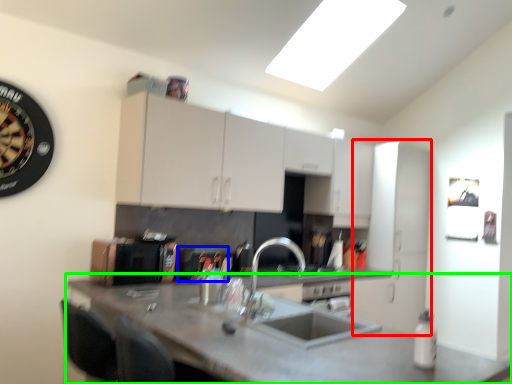
Question: Which object is the closest to the cabinetry (highlighted by a red box)? Choose among these: appliance (highlighted by a blue box) or countertop (highlighted by a green box).

Choices:
 (A) appliance
 (B) countertop

Answer: (A)